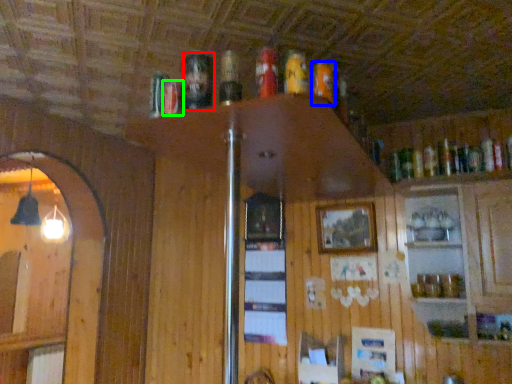
Question: Considering the real-world distances, which object is farthest from beer (highlighted by a red box)? beer (highlighted by a blue box) or beer (highlighted by a green box)?

Choices:
 (A) beer
 (B) beer

Answer: (A)